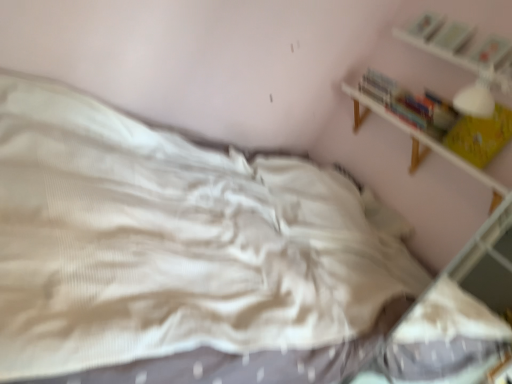
This screenshot has width=512, height=384. What do you see at coordinates (490, 51) in the screenshot? I see `hardcover book at upper right, which is counted as the 3th book, starting from the top` at bounding box center [490, 51].

The height and width of the screenshot is (384, 512). What do you see at coordinates (416, 138) in the screenshot? I see `white wooden shelf at upper right` at bounding box center [416, 138].

The image size is (512, 384). Identify the location of hardcover book at upper right, positioned as the 4th book in bottom-to-top order. (425, 25).

From their relative heights in the image, would you say hardcover book at upper right, positioned as the first book in top-to-bottom order, is taller or shorter than white wooden shelf at upper right?

Clearly, hardcover book at upper right, positioned as the first book in top-to-bottom order, is shorter compared to white wooden shelf at upper right.

Relative to white wooden shelf at upper right, is hardcover book at upper right, positioned as the 4th book in bottom-to-top order, in front or behind?

In the image, hardcover book at upper right, positioned as the 4th book in bottom-to-top order, appears behind white wooden shelf at upper right.

Is hardcover book at upper right, positioned as the first book in top-to-bottom order, located outside white wooden shelf at upper right?

Yes.

Image resolution: width=512 pixels, height=384 pixels. I want to click on shelf on the left of hardcover book at upper right, positioned as the first book in top-to-bottom order, so click(x=416, y=138).

Considering the positions of objects yellow paper book at upper right, positioned as the first book in bottom-to-top order, and hardcover book at upper right, acting as the third book starting from the bottom, in the image provided, who is more to the right, yellow paper book at upper right, positioned as the first book in bottom-to-top order, or hardcover book at upper right, acting as the third book starting from the bottom,?

From the viewer's perspective, yellow paper book at upper right, positioned as the first book in bottom-to-top order, appears more on the right side.

From a real-world perspective, is yellow paper book at upper right, which is the fourth book in top-to-bottom order, positioned above or below hardcover book at upper right, the second book when ordered from top to bottom?

In terms of real-world spatial position, yellow paper book at upper right, which is the fourth book in top-to-bottom order, is below hardcover book at upper right, the second book when ordered from top to bottom.

From the image's perspective, does yellow paper book at upper right, positioned as the first book in bottom-to-top order, appear lower than hardcover book at upper right, acting as the third book starting from the bottom?

Indeed, from the image's perspective, yellow paper book at upper right, positioned as the first book in bottom-to-top order, is shown beneath hardcover book at upper right, acting as the third book starting from the bottom.

Can we say yellow paper book at upper right, positioned as the first book in bottom-to-top order, lies outside hardcover book at upper right, acting as the third book starting from the bottom?

Yes.

Considering the positions of objects hardcover book at upper right, which is counted as the 3th book, starting from the top, and hardcover book at upper right, the second book when ordered from top to bottom, in the image provided, who is behind, hardcover book at upper right, which is counted as the 3th book, starting from the top, or hardcover book at upper right, the second book when ordered from top to bottom,?

hardcover book at upper right, the second book when ordered from top to bottom, is further from the camera.

From a real-world perspective, is hardcover book at upper right, which is counted as the 3th book, starting from the top, on top of hardcover book at upper right, the second book when ordered from top to bottom?

Indeed, from a real-world perspective, hardcover book at upper right, which is counted as the 3th book, starting from the top, stands above hardcover book at upper right, the second book when ordered from top to bottom.

Measure the distance from hardcover book at upper right, which is counted as the 3th book, starting from the top, to hardcover book at upper right, the second book when ordered from top to bottom.

hardcover book at upper right, which is counted as the 3th book, starting from the top, is 7.76 inches from hardcover book at upper right, the second book when ordered from top to bottom.

From the picture: Does hardcover book at upper right, which is counted as the 3th book, starting from the top, have a lesser width compared to hardcover book at upper right, the second book when ordered from top to bottom?

Yes.

From the image's perspective, does white wooden shelf at upper right appear lower than hardcover book at upper right, the second book when ordered from top to bottom?

Indeed, from the image's perspective, white wooden shelf at upper right is shown beneath hardcover book at upper right, the second book when ordered from top to bottom.

Is white wooden shelf at upper right at the right side of hardcover book at upper right, acting as the third book starting from the bottom?

Incorrect, white wooden shelf at upper right is not on the right side of hardcover book at upper right, acting as the third book starting from the bottom.

Would you consider white wooden shelf at upper right to be distant from hardcover book at upper right, acting as the third book starting from the bottom?

No, white wooden shelf at upper right is not far from hardcover book at upper right, acting as the third book starting from the bottom.

Measure the distance from white wooden shelf at upper right to hardcover book at upper right, the second book when ordered from top to bottom.

A distance of 52.91 centimeters exists between white wooden shelf at upper right and hardcover book at upper right, the second book when ordered from top to bottom.

Is point (488, 59) closer or farther from the camera than point (485, 182)?

Point (488, 59).

Is hardcover book at upper right, which is the 2th book from bottom to top, shorter than white wooden shelf at upper right?

Yes.

Does hardcover book at upper right, which is the 2th book from bottom to top, have a smaller size compared to white wooden shelf at upper right?

Yes, hardcover book at upper right, which is the 2th book from bottom to top, is smaller than white wooden shelf at upper right.

From the picture: Is hardcover book at upper right, which is counted as the 3th book, starting from the top, far from white wooden shelf at upper right?

No, there isn't a large distance between hardcover book at upper right, which is counted as the 3th book, starting from the top, and white wooden shelf at upper right.

Is white wooden shelf at upper right bigger or smaller than hardcover book at upper right, which is counted as the 3th book, starting from the top?

In the image, white wooden shelf at upper right appears to be larger than hardcover book at upper right, which is counted as the 3th book, starting from the top.

Where is `shelf located in front of the hardcover book at upper right, which is the 2th book from bottom to top`? The image size is (512, 384). shelf located in front of the hardcover book at upper right, which is the 2th book from bottom to top is located at coordinates (416, 138).

Would you say white wooden shelf at upper right is to the left or to the right of hardcover book at upper right, which is the 2th book from bottom to top, in the picture?

white wooden shelf at upper right is positioned on hardcover book at upper right, which is the 2th book from bottom to top,'s left side.

Is white wooden shelf at upper right in contact with hardcover book at upper right, which is the 2th book from bottom to top?

There is a gap between white wooden shelf at upper right and hardcover book at upper right, which is the 2th book from bottom to top.

Can you confirm if hardcover book at upper right, positioned as the first book in top-to-bottom order, is wider than yellow paper book at upper right, which is the fourth book in top-to-bottom order?

Indeed, hardcover book at upper right, positioned as the first book in top-to-bottom order, has a greater width compared to yellow paper book at upper right, which is the fourth book in top-to-bottom order.

Are hardcover book at upper right, positioned as the first book in top-to-bottom order, and yellow paper book at upper right, which is the fourth book in top-to-bottom order, making contact?

They are not placed beside each other.

Considering the relative positions of hardcover book at upper right, positioned as the first book in top-to-bottom order, and yellow paper book at upper right, which is the fourth book in top-to-bottom order, in the image provided, is hardcover book at upper right, positioned as the first book in top-to-bottom order, in front of yellow paper book at upper right, which is the fourth book in top-to-bottom order,?

No, it is not.

From the image's perspective, which book is the 3rd one above the yellow paper book at upper right, positioned as the first book in bottom-to-top order? Please provide its 2D coordinates.

[(425, 25)]

From a real-world perspective, count 4th books upward from the white wooden shelf at upper right and point to it. Please provide its 2D coordinates.

[(425, 25)]

Identify the location of the 1st book to the left when counting from the yellow paper book at upper right, which is the fourth book in top-to-bottom order. (453, 36).

Which object lies nearer to the anchor point hardcover book at upper right, which is the 2th book from bottom to top, white wooden shelf at upper right or hardcover book at upper right, positioned as the first book in top-to-bottom order?

Among the two, hardcover book at upper right, positioned as the first book in top-to-bottom order, is located nearer to hardcover book at upper right, which is the 2th book from bottom to top.

Considering their positions, is hardcover book at upper right, which is the 2th book from bottom to top, positioned further to white wooden shelf at upper right than yellow paper book at upper right, which is the fourth book in top-to-bottom order?

hardcover book at upper right, which is the 2th book from bottom to top, is further to white wooden shelf at upper right.

Based on their spatial positions, is hardcover book at upper right, positioned as the 4th book in bottom-to-top order, or hardcover book at upper right, which is the 2th book from bottom to top, closer to hardcover book at upper right, the second book when ordered from top to bottom?

The object closer to hardcover book at upper right, the second book when ordered from top to bottom, is hardcover book at upper right, positioned as the 4th book in bottom-to-top order.

Estimate the real-world distances between objects in this image. Which object is further from hardcover book at upper right, positioned as the first book in top-to-bottom order, yellow paper book at upper right, which is the fourth book in top-to-bottom order, or white wooden shelf at upper right?

The object further to hardcover book at upper right, positioned as the first book in top-to-bottom order, is yellow paper book at upper right, which is the fourth book in top-to-bottom order.

When comparing their distances from yellow paper book at upper right, which is the fourth book in top-to-bottom order, does white wooden shelf at upper right or hardcover book at upper right, positioned as the 4th book in bottom-to-top order, seem closer?

white wooden shelf at upper right is closer to yellow paper book at upper right, which is the fourth book in top-to-bottom order.

Looking at the image, which one is located closer to hardcover book at upper right, positioned as the 4th book in bottom-to-top order, hardcover book at upper right, the second book when ordered from top to bottom, or yellow paper book at upper right, which is the fourth book in top-to-bottom order?

Based on the image, hardcover book at upper right, the second book when ordered from top to bottom, appears to be nearer to hardcover book at upper right, positioned as the 4th book in bottom-to-top order.

Based on their spatial positions, is hardcover book at upper right, positioned as the first book in top-to-bottom order, or hardcover book at upper right, acting as the third book starting from the bottom, closer to white wooden shelf at upper right?

hardcover book at upper right, acting as the third book starting from the bottom.

When comparing their distances from yellow paper book at upper right, positioned as the first book in bottom-to-top order, does hardcover book at upper right, positioned as the first book in top-to-bottom order, or hardcover book at upper right, the second book when ordered from top to bottom, seem further?

hardcover book at upper right, positioned as the first book in top-to-bottom order.

Image resolution: width=512 pixels, height=384 pixels. Identify the location of book between hardcover book at upper right, acting as the third book starting from the bottom, and yellow paper book at upper right, positioned as the first book in bottom-to-top order, from top to bottom. (490, 51).

Locate an element on the screen. book that lies between hardcover book at upper right, which is the 2th book from bottom to top, and white wooden shelf at upper right from top to bottom is located at coordinates (480, 136).

I want to click on book positioned between hardcover book at upper right, which is counted as the 3th book, starting from the top, and hardcover book at upper right, positioned as the 4th book in bottom-to-top order, from near to far, so click(x=453, y=36).